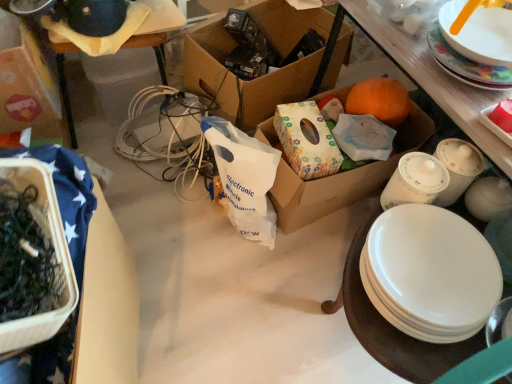
Question: In the image, is cardboard box at upper left, positioned as the 1th box in left-to-right order, positioned in front of or behind translucent plastic container at left, arranged as the 2th box when viewed from the left?

Choices:
 (A) behind
 (B) front

Answer: (A)

Question: Based on their positions, is cardboard box at upper left, placed as the fourth box when sorted from right to left, located to the left or right of translucent plastic container at left, arranged as the 2th box when viewed from the left?

Choices:
 (A) left
 (B) right

Answer: (A)

Question: Estimate the real-world distances between objects in this image. Which object is farther from the cardboard box at center, which is counted as the 4th box, starting from the left?

Choices:
 (A) white glossy plate at upper right, acting as the second plate starting from the bottom
 (B) cardboard box at upper left, placed as the fourth box when sorted from right to left
 (C) white glossy plate at lower right, placed as the 1th plate when sorted from bottom to top
 (D) white plastic bag at center
 (E) matte white platter at upper right

Answer: (B)

Question: Estimate the real-world distances between objects in this image. Which object is farther from the cardboard box at upper left, positioned as the 1th box in left-to-right order?

Choices:
 (A) white glossy plate at upper right, acting as the second plate starting from the bottom
 (B) white plastic bag at center
 (C) brown cardboard box at center, the 3th box from the left
 (D) translucent plastic container at left, arranged as the 2th box when viewed from the left
 (E) white glossy plate at lower right, placed as the 1th plate when sorted from bottom to top

Answer: (A)